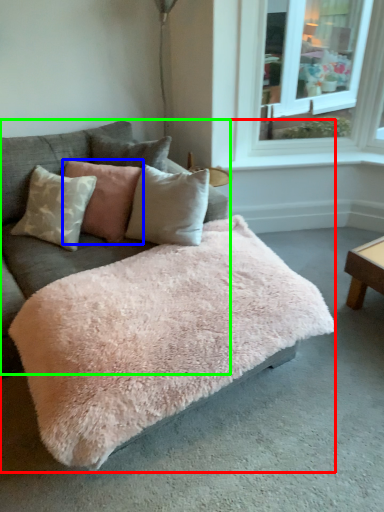
Question: Considering the real-world distances, which object is closest to studio couch (highlighted by a red box)? pillow (highlighted by a blue box) or couch (highlighted by a green box).

Choices:
 (A) pillow
 (B) couch

Answer: (B)